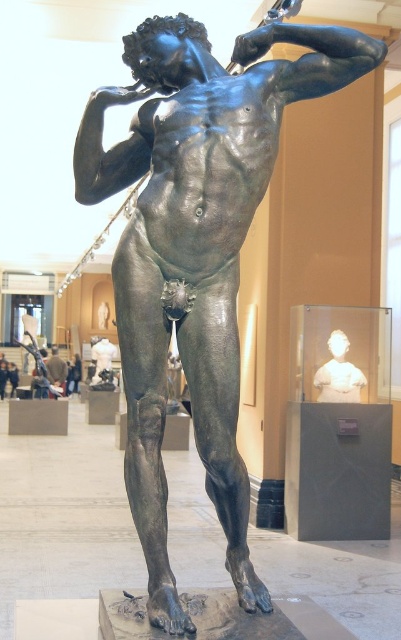
You are an art student standing in the museum and want to sketch the white marble bust at center and the bronze statue at center. Which object should you draw first if you want to capture the one that is positioned to the right side of the other?

The white marble bust at center is to the right of the bronze statue at center, so you should draw the white marble bust at center first if you want to capture the one positioned to the right.

You are a museum visitor standing in front of the white marble bust at center and the bronze statue at center. Which object is closer to you?

The white marble bust at center is closer to you because it is in front of the bronze statue at center.

You are an art student who wants to compare the sizes of the white marble bust at center and the bronze statue at center in the museum. Which one is bigger?

The bronze statue at center is bigger than the white marble bust at center.